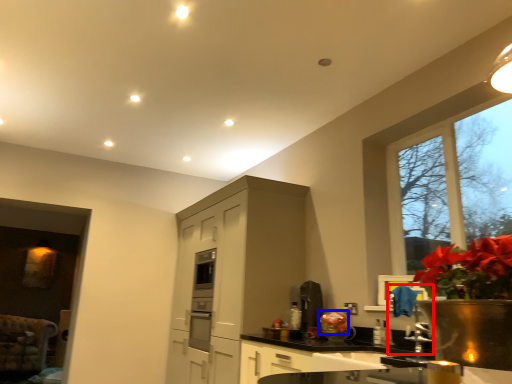
Question: Among these objects, which one is farthest to the camera, faucet (highlighted by a red box) or flower (highlighted by a blue box)?

Choices:
 (A) faucet
 (B) flower

Answer: (B)